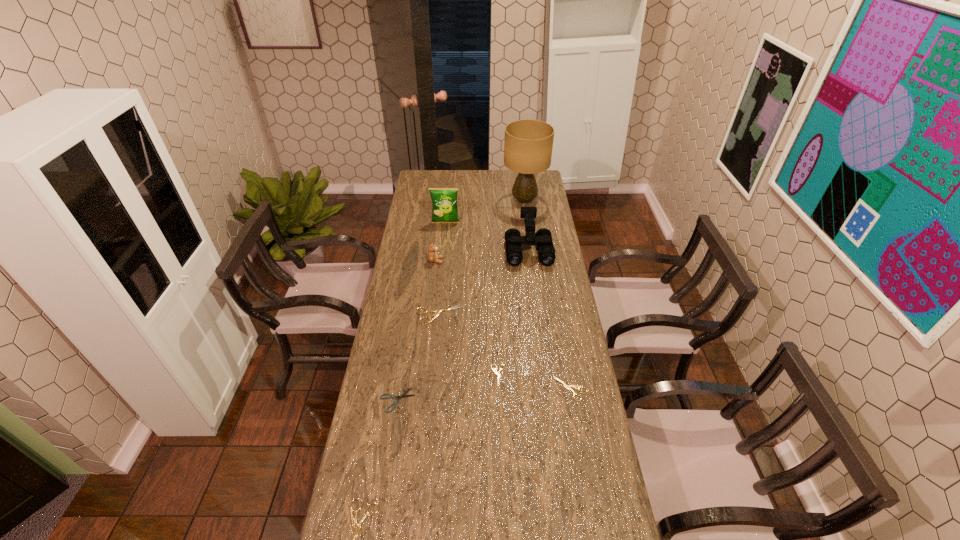
You are a GUI agent. You are given a task and a screenshot of the screen. Output one action in this format:
    pyautogui.click(x=<x>, y=<y>)
    Task: Click on the shears that is the fifth closest to the eighth shortest object
    The width and height of the screenshot is (960, 540).
    Given the screenshot: What is the action you would take?
    pyautogui.click(x=357, y=526)

Identify which shears is located as the fourth nearest to the second smallest beige shears. Please provide its 2D coordinates. Your answer should be formatted as a tuple, i.e. [(x, y)], where the tuple contains the x and y coordinates of a point satisfying the conditions above.

[(357, 526)]

Identify the location of beige shears object that ranks as the second closest to the crisp (potato chip). The width and height of the screenshot is (960, 540). (496, 373).

Identify the location of beige shears that stands as the third closest to the third shortest object. Image resolution: width=960 pixels, height=540 pixels. (357, 526).

The width and height of the screenshot is (960, 540). I want to click on free spot that satisfies the following two spatial constraints: 1. on the front-facing side of the teddy bear; 2. on the right side of the third biggest beige shears, so click(x=421, y=389).